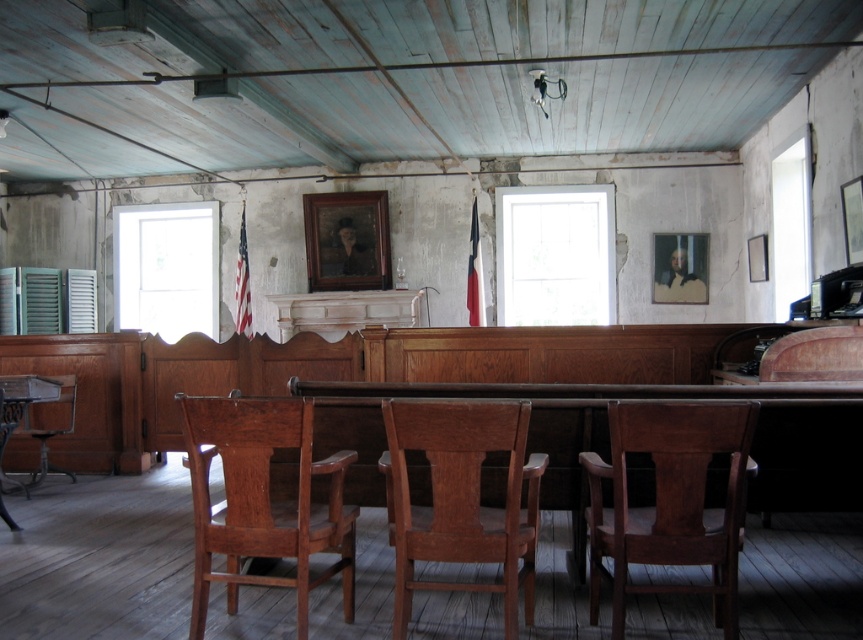
Is polished wood chair at center smaller than white matte shutter at left?

No, polished wood chair at center is not smaller than white matte shutter at left.

Does polished wood chair at center have a lesser height compared to white matte shutter at left?

Incorrect, polished wood chair at center's height does not fall short of white matte shutter at left's.

Is point (690, 436) positioned behind point (72, 323)?

No, (690, 436) is in front of (72, 323).

Image resolution: width=863 pixels, height=640 pixels. In order to click on polished wood chair at center in this screenshot , I will do `click(671, 500)`.

Is polished wood chair at center closer to the viewer compared to wooden chair at lower left?

Yes, polished wood chair at center is in front of wooden chair at lower left.

Who is more forward, (662,458) or (5,442)?

Positioned in front is point (662,458).

Is point (751, 403) behind point (11, 406)?

No, (751, 403) is closer to viewer.

Find the location of a particular element. polished wood chair at center is located at coordinates (671, 500).

Consider the image. Which is more to the left, white painted wood shutter at left or wooden chair at left?

Positioned to the left is white painted wood shutter at left.

What do you see at coordinates (48, 300) in the screenshot? Image resolution: width=863 pixels, height=640 pixels. I see `white painted wood shutter at left` at bounding box center [48, 300].

Is point (90, 285) more distant than point (26, 422)?

Yes, it is.

At what (x,y) coordinates should I click in order to perform the action: click on white painted wood shutter at left. Please return your answer as a coordinate pair (x, y). This screenshot has width=863, height=640. Looking at the image, I should click on (48, 300).